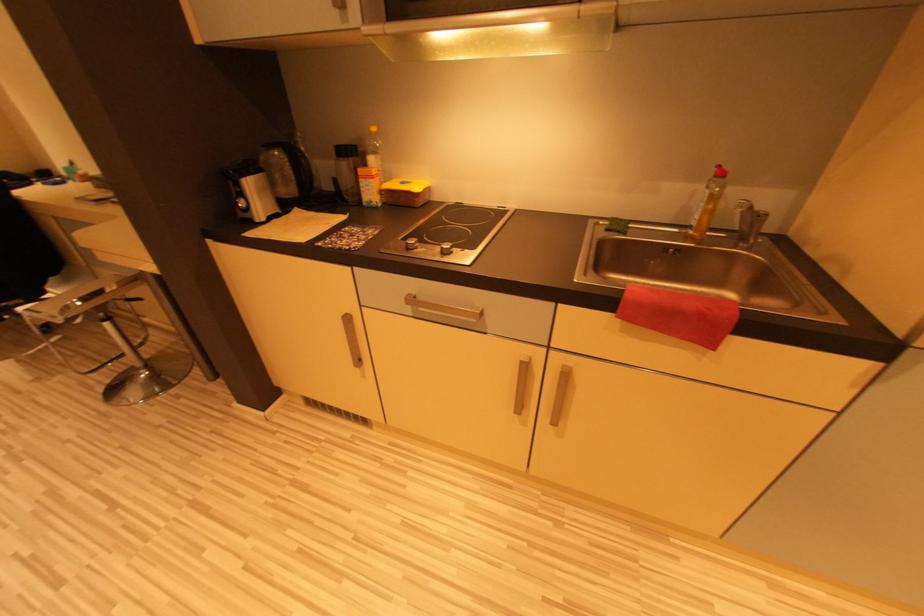
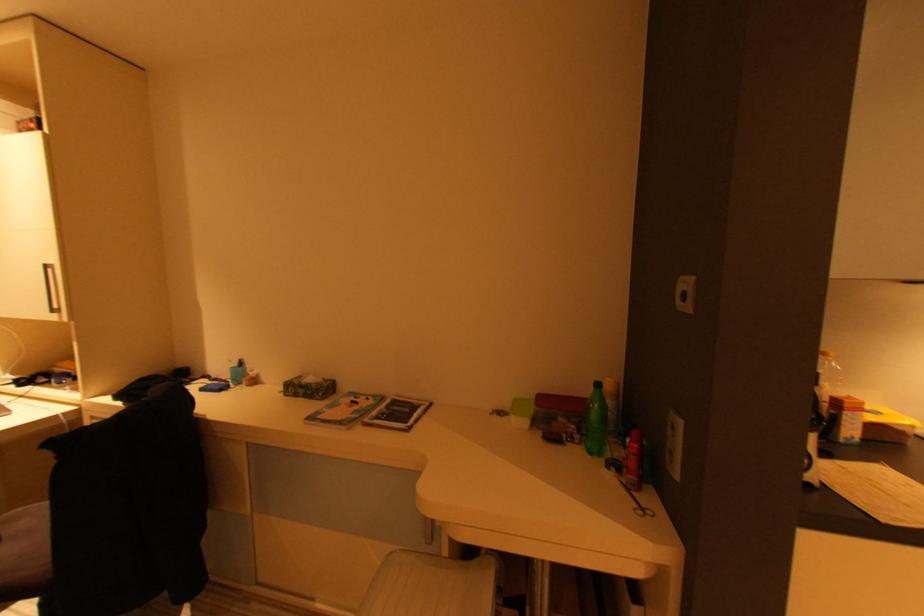
Question: What movement of the cameraman would produce the second image?

Choices:
 (A) Left
 (B) Right
 (C) Forward
 (D) Backward

Answer: (A)